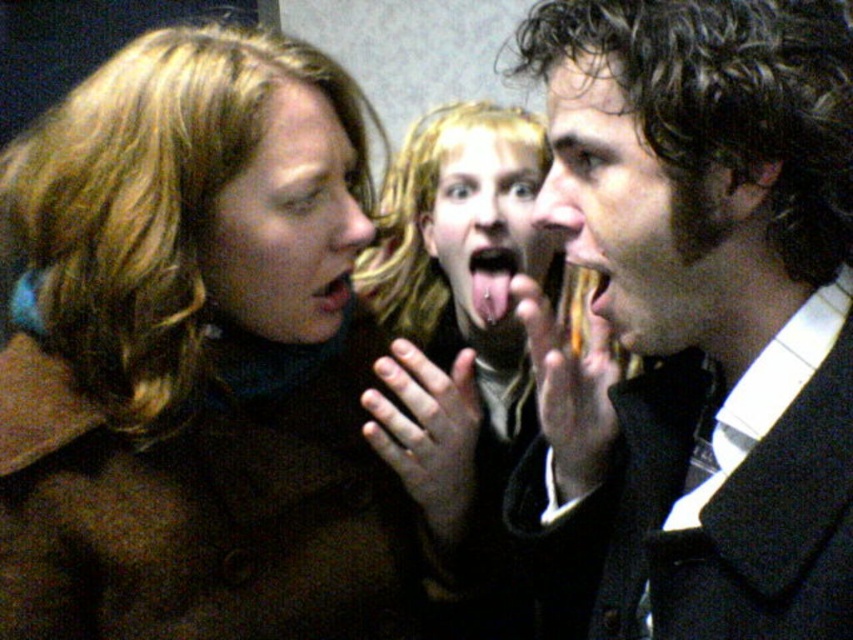
Question: Which object is closer to the camera taking this photo?

Choices:
 (A) curly hair at center
 (B) brown woolen coat at left
 (C) smooth skin face at center
 (D) black wool coat at right

Answer: (D)

Question: Is smooth blonde hair at center further to camera compared to smooth skin face at center?

Choices:
 (A) no
 (B) yes

Answer: (A)

Question: Which is farther from the pink glossy tongue at center?

Choices:
 (A) matte brown hair at center
 (B) smooth glossy tongue at center

Answer: (B)

Question: Can you confirm if brown woolen coat at left is smaller than curly hair at center?

Choices:
 (A) yes
 (B) no

Answer: (B)

Question: Is smooth glossy tongue at center below pink glossy tongue at center?

Choices:
 (A) yes
 (B) no

Answer: (B)

Question: Considering the real-world distances, which object is closest to the smooth skin face at center?

Choices:
 (A) pink glossy tongue at center
 (B) smooth glossy tongue at center

Answer: (B)